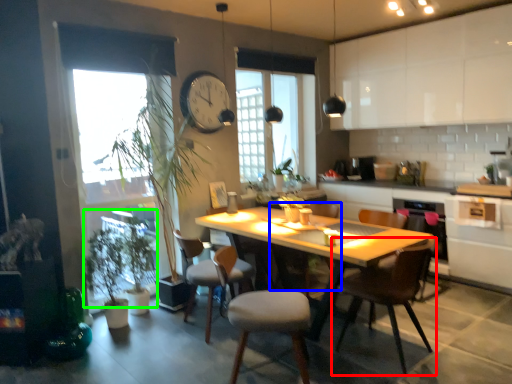
Question: Considering the real-world distances, which object is farthest from chair (highlighted by a red box)? chair (highlighted by a blue box) or plant (highlighted by a green box)?

Choices:
 (A) chair
 (B) plant

Answer: (A)